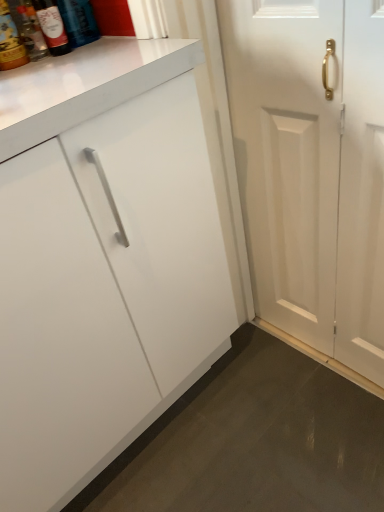
Question: Is point (64, 5) closer or farther from the camera than point (372, 19)?

Choices:
 (A) farther
 (B) closer

Answer: (A)

Question: In terms of size, does matte glass bottle at upper left, arranged as the 2th bottle when viewed from the left, appear bigger or smaller than white wooden door at right?

Choices:
 (A) small
 (B) big

Answer: (A)

Question: Which object is positioned farthest from the matte glass bottle at upper left, which ranks as the 1th bottle in right-to-left order?

Choices:
 (A) matte glass bottle at upper left, placed as the fourth bottle when sorted from right to left
 (B) matte glass bottle at upper left, the 3th bottle positioned from the right
 (C) matte glass bottle at upper left, which is the third bottle from left to right
 (D) white wooden door at right

Answer: (D)

Question: Considering the real-world distances, which object is farthest from the matte glass bottle at upper left, arranged as the 2th bottle when viewed from the left?

Choices:
 (A) white wooden door at right
 (B) matte glass bottle at upper left, which is the 1th bottle in left-to-right order
 (C) matte glass bottle at upper left, which appears as the second bottle when viewed from the right
 (D) matte glass bottle at upper left, which ranks as the 1th bottle in right-to-left order

Answer: (A)